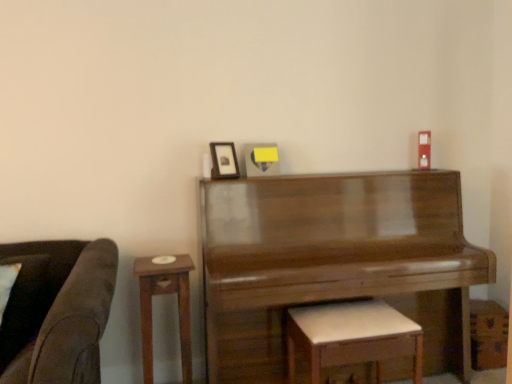
Question: Would you say wooden side table at left is inside or outside matte black picture frame at upper center?

Choices:
 (A) outside
 (B) inside

Answer: (A)

Question: From the image's perspective, is wooden side table at left located above or below matte black picture frame at upper center?

Choices:
 (A) above
 (B) below

Answer: (B)

Question: Which is farther from the shiny brown piano at center?

Choices:
 (A) white leather stool at lower center
 (B) wooden side table at left
 (C) matte black picture frame at upper center

Answer: (C)

Question: Based on their relative distances, which object is farther from the white leather stool at lower center?

Choices:
 (A) matte black picture frame at upper center
 (B) shiny brown piano at center
 (C) wooden side table at left

Answer: (A)